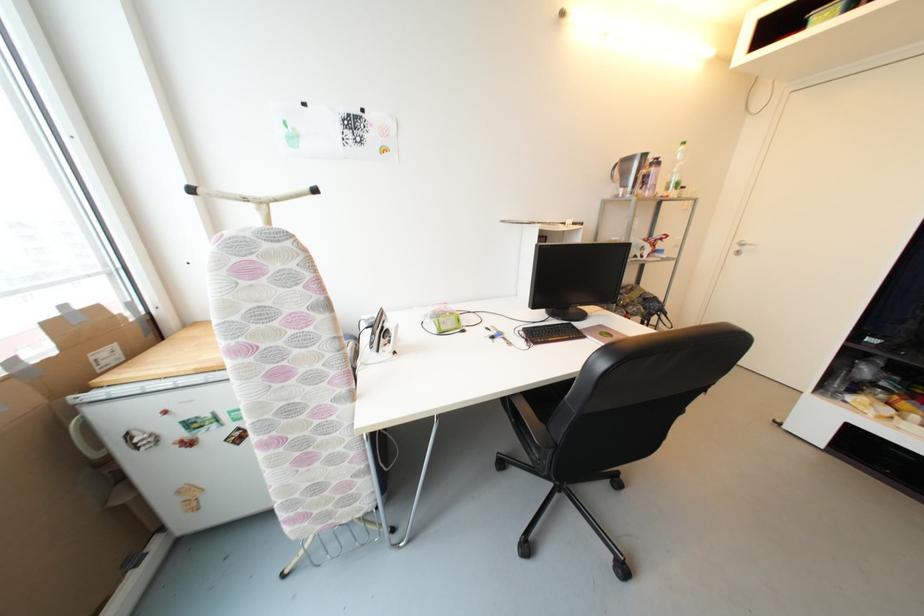
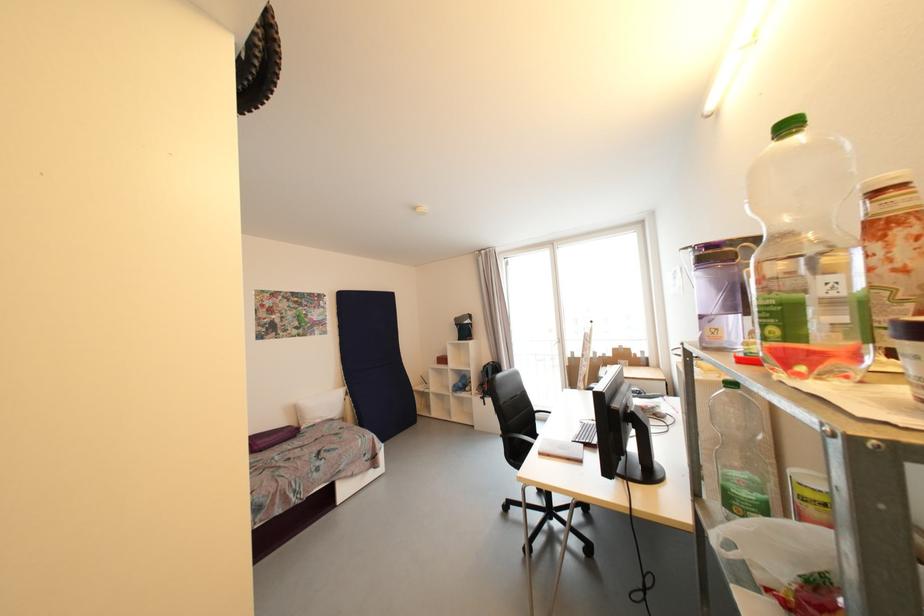
Question: I am providing you with two images of the same scene from different viewpoints. After the viewpoint changes to image2, which objects are now occluded?

Choices:
 (A) white plastic bag
 (B) black backpack
 (C) faucet spout
 (D) black chair sitting surface

Answer: (D)